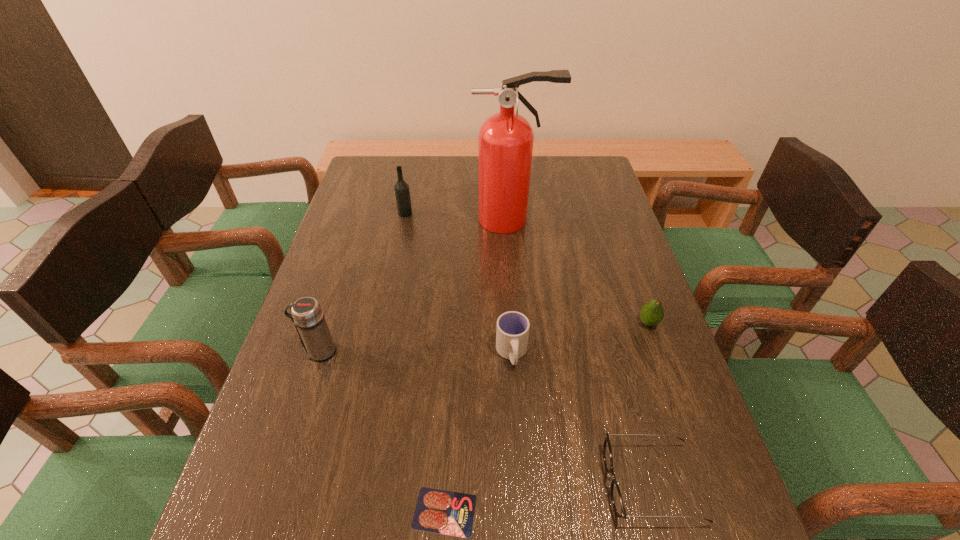
The height and width of the screenshot is (540, 960). What are the coordinates of `vacant space at the right edge of the desktop` in the screenshot? It's located at (597, 285).

In the image, there is a desktop. Where is `vacant space at the far left corner`? vacant space at the far left corner is located at coordinates (375, 172).

Locate an element on the screen. This screenshot has width=960, height=540. vacant space at the far right corner of the desktop is located at coordinates (576, 177).

At what (x,y) coordinates should I click in order to perform the action: click on free space between the cup and the tallest object. Please return your answer as a coordinate pair (x, y). The height and width of the screenshot is (540, 960). Looking at the image, I should click on (512, 286).

This screenshot has width=960, height=540. In order to click on vacant space in between the tallest object and the cup in this screenshot , I will do `click(512, 286)`.

Identify the location of free space that is in between the tallest object and the leftmost object. The image size is (960, 540). (416, 286).

You are a GUI agent. You are given a task and a screenshot of the screen. Output one action in this format:
    pyautogui.click(x=<x>, y=<y>)
    Task: Click on the free space between the vodka and the tallest object
    This screenshot has height=540, width=960.
    Given the screenshot: What is the action you would take?
    pyautogui.click(x=459, y=217)

This screenshot has width=960, height=540. I want to click on free space between the leftmost object and the third farthest object, so click(x=484, y=337).

At what (x,y) coordinates should I click in order to perform the action: click on free spot between the tallest object and the thermos bottle. Please return your answer as a coordinate pair (x, y). Looking at the image, I should click on point(416,286).

The width and height of the screenshot is (960, 540). I want to click on free space that is in between the salami and the leftmost object, so click(382, 431).